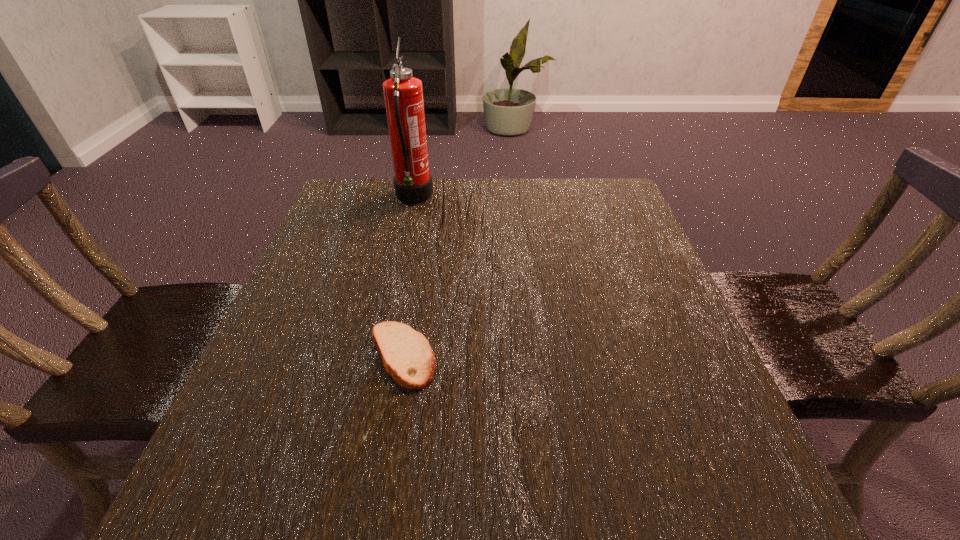
The height and width of the screenshot is (540, 960). In the image, there is a desktop. Identify the location of blank space at the near edge. (596, 517).

At what (x,y) coordinates should I click in order to perform the action: click on vacant area at the left edge of the desktop. Please return your answer as a coordinate pair (x, y). The height and width of the screenshot is (540, 960). Looking at the image, I should click on (349, 275).

In order to click on vacant space at the right edge in this screenshot , I will do `click(699, 388)`.

Where is `free space that satisfies the following two spatial constraints: 1. on the front-facing side of the fire extinguisher; 2. on the left side of the nearer object`? free space that satisfies the following two spatial constraints: 1. on the front-facing side of the fire extinguisher; 2. on the left side of the nearer object is located at coordinates (379, 356).

Where is `vacant space that satisfies the following two spatial constraints: 1. on the back side of the pita bread; 2. on the front-facing side of the farther object`? vacant space that satisfies the following two spatial constraints: 1. on the back side of the pita bread; 2. on the front-facing side of the farther object is located at coordinates (429, 198).

Locate an element on the screen. The width and height of the screenshot is (960, 540). free spot that satisfies the following two spatial constraints: 1. on the front-facing side of the taller object; 2. on the right side of the pita bread is located at coordinates (379, 356).

At what (x,y) coordinates should I click in order to perform the action: click on free space that satisfies the following two spatial constraints: 1. on the front-facing side of the farther object; 2. on the back side of the pita bread. Please return your answer as a coordinate pair (x, y). Looking at the image, I should click on (379, 356).

At what (x,y) coordinates should I click in order to perform the action: click on vacant region that satisfies the following two spatial constraints: 1. on the front-facing side of the shorter object; 2. on the left side of the farther object. Please return your answer as a coordinate pair (x, y). Image resolution: width=960 pixels, height=540 pixels. Looking at the image, I should click on (379, 356).

Locate an element on the screen. The width and height of the screenshot is (960, 540). vacant point that satisfies the following two spatial constraints: 1. on the front-facing side of the nearer object; 2. on the left side of the taller object is located at coordinates (x=379, y=356).

Image resolution: width=960 pixels, height=540 pixels. Identify the location of vacant area that satisfies the following two spatial constraints: 1. on the front-facing side of the pita bread; 2. on the left side of the taller object. (379, 356).